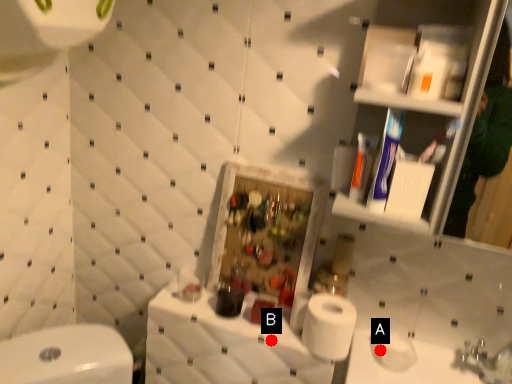
Question: Two points are circled on the image, labeled by A and B beside each circle. Which point is closer to the camera?

Choices:
 (A) A is closer
 (B) B is closer

Answer: (B)